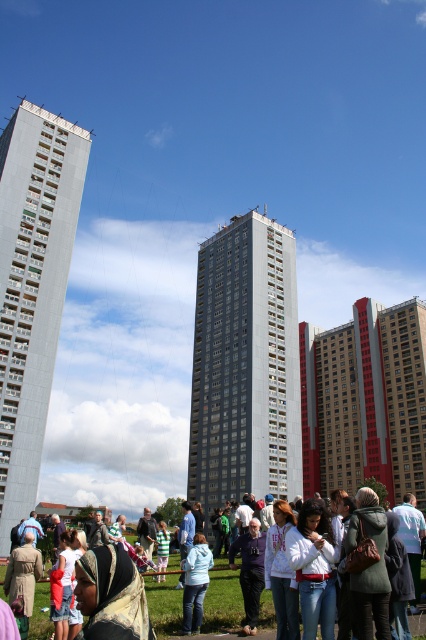
Find the location of a particular element. Image resolution: width=426 pixels, height=640 pixels. gray concrete building at center is located at coordinates (244, 365).

Describe the element at coordinates (244, 365) in the screenshot. The width and height of the screenshot is (426, 640). I see `gray concrete building at center` at that location.

Find the location of a particular element. The height and width of the screenshot is (640, 426). gray concrete building at center is located at coordinates (244, 365).

I want to click on gray concrete building at center, so click(244, 365).

This screenshot has width=426, height=640. In order to click on gray concrete building at center in this screenshot , I will do `click(244, 365)`.

Is gray concrete building at center further to the viewer compared to light blue denim jacket at center?

Yes.

This screenshot has height=640, width=426. I want to click on gray concrete building at center, so click(x=244, y=365).

Consider the image. Is white cotton shirt at center wider than light blue denim jacket at center?

Indeed, white cotton shirt at center has a greater width compared to light blue denim jacket at center.

Can you confirm if white cotton shirt at center is thinner than light blue denim jacket at center?

In fact, white cotton shirt at center might be wider than light blue denim jacket at center.

Image resolution: width=426 pixels, height=640 pixels. What do you see at coordinates (222, 600) in the screenshot?
I see `white cotton shirt at center` at bounding box center [222, 600].

The width and height of the screenshot is (426, 640). Find the location of `white cotton shirt at center`. white cotton shirt at center is located at coordinates (222, 600).